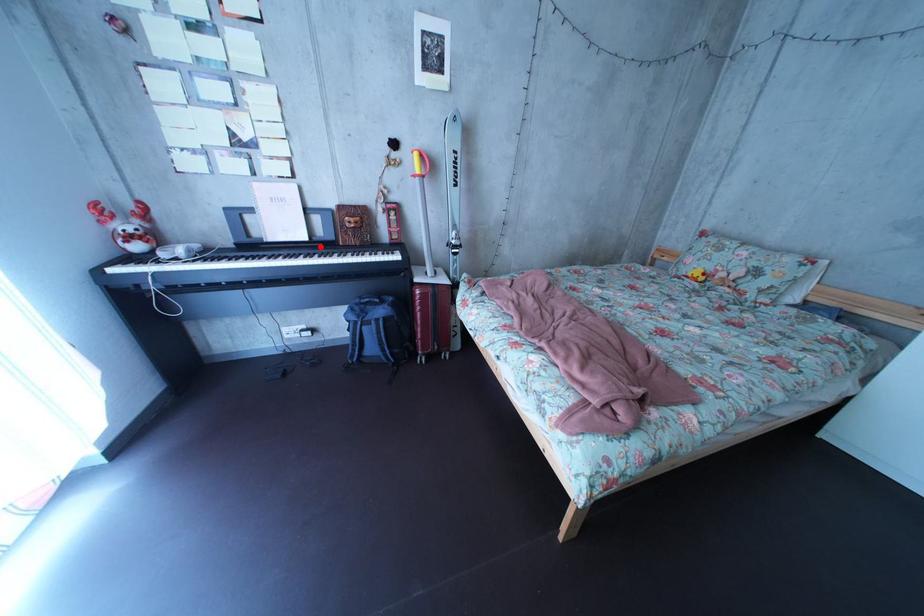
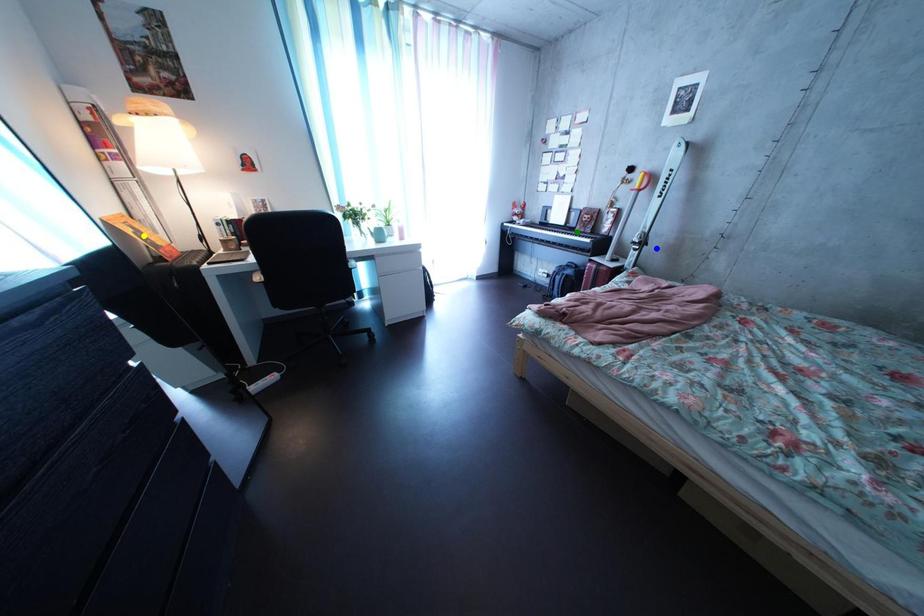
Question: I am providing you with two images of the same scene from different viewpoints. A red point is marked on the first image. You are given multiple points on the second image. Which point in image 2 represents the same 3d spot as the red point in image 1?

Choices:
 (A) green point
 (B) blue point
 (C) yellow point

Answer: (A)